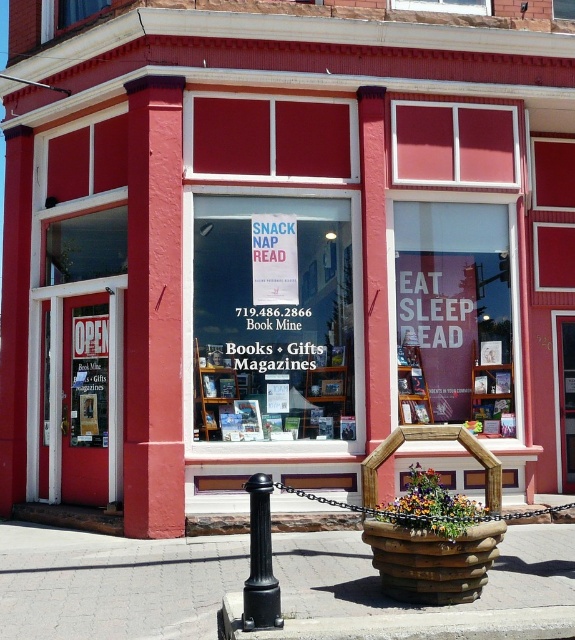
Based on the photo, you are a delivery person trying to park your 2.5 meter wide truck in front of the bookstore. The brick pavement at lower center and concrete at lower center are the only available surfaces. Based on the scene, can you determine if either of these surfaces can accommodate your truck?

The brick pavement at lower center occupies less space than concrete at lower center. Since the concrete at lower center is larger, it can accommodate the 2.5 meter wide truck.

You are standing outside the bookstore and notice the concrete at lower center and the black plastic pole at lower center. Which object is positioned to the right side from your perspective?

The concrete at lower center is positioned to the right of the black plastic pole at lower center.

You are a delivery person trying to unload a package that requires placing it on a surface. You see the concrete at lower center and the black plastic pole at lower center. Which surface is shorter and suitable for placing the package?

The concrete at lower center is shorter than the black plastic pole at lower center, so the concrete at lower center is suitable for placing the package.